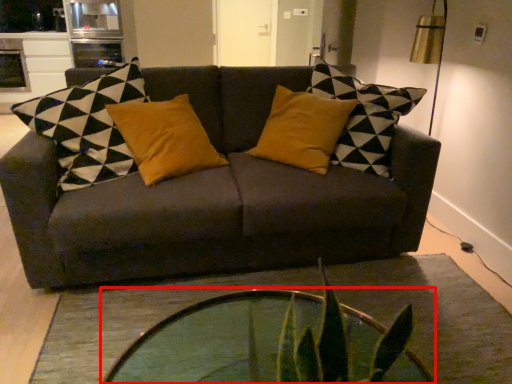
Question: From the image, what is the correct spatial relationship of coffee table (annotated by the red box) in relation to studio couch?

Choices:
 (A) left
 (B) right

Answer: (B)